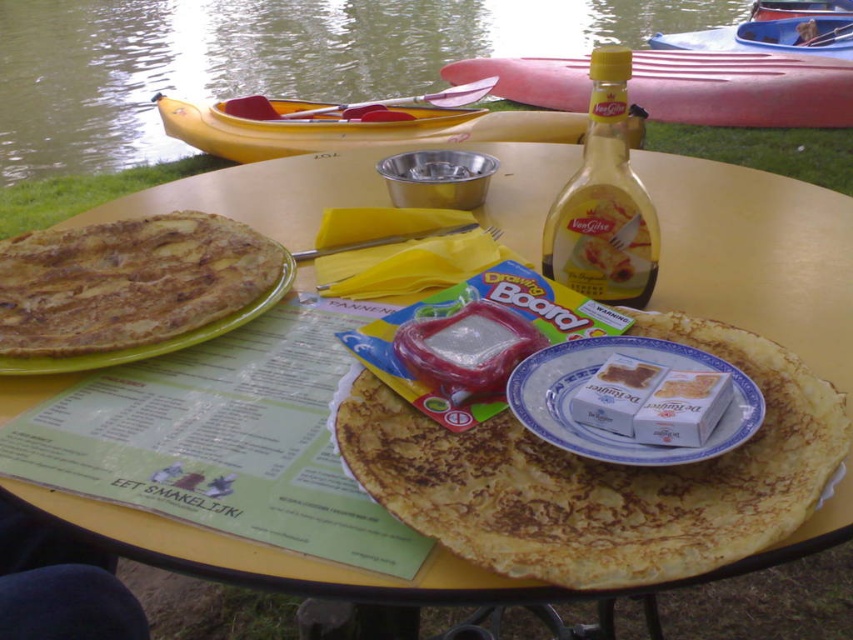
Can you confirm if rubber kayak at upper center is positioned to the right of yellow glass bottle at center?

Indeed, rubber kayak at upper center is positioned on the right side of yellow glass bottle at center.

Can you confirm if rubber kayak at upper center is thinner than yellow glass bottle at center?

No.

Is point (772, 93) positioned behind point (630, 284)?

That is True.

Identify the location of rubber kayak at upper center. This screenshot has width=853, height=640. (741, 88).

Is white porcelain plate at center thinner than yellow plastic canoe at upper left?

Correct, white porcelain plate at center's width is less than yellow plastic canoe at upper left's.

Does point (621, 355) come behind point (225, 109)?

That is False.

At what (x,y) coordinates should I click in order to perform the action: click on white porcelain plate at center. Please return your answer as a coordinate pair (x, y). The height and width of the screenshot is (640, 853). Looking at the image, I should click on (631, 401).

Identify the location of golden crispy pancake at center. (602, 477).

Who is shorter, golden crispy pancake at center or rubber kayak at upper center?

Standing shorter between the two is golden crispy pancake at center.

Where is `golden crispy pancake at center`? golden crispy pancake at center is located at coordinates (602, 477).

Where is `golden crispy pancake at center`? The image size is (853, 640). golden crispy pancake at center is located at coordinates (602, 477).